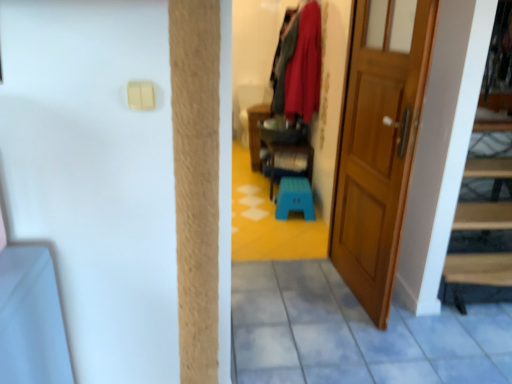
The image size is (512, 384). I want to click on vacant region in front of wooden door at right, so click(344, 342).